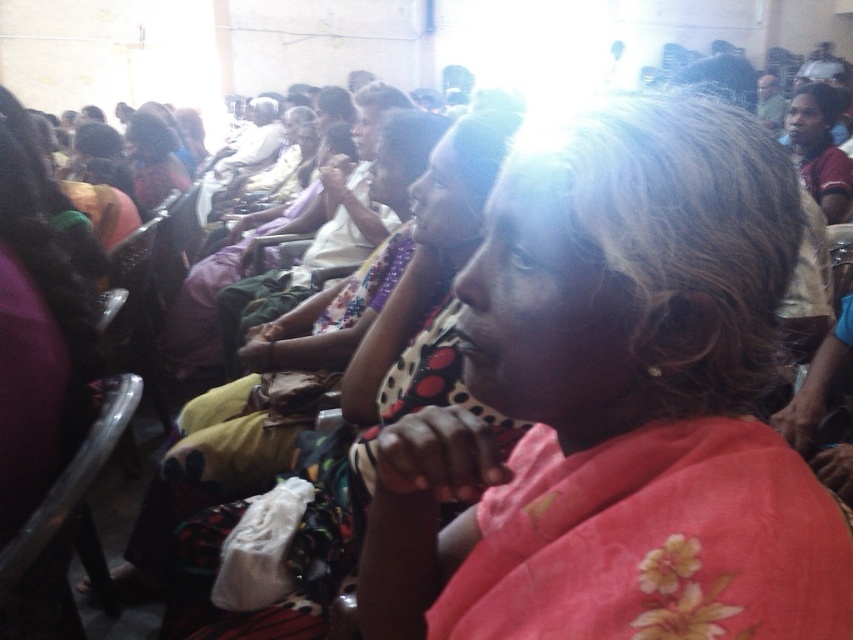
Question: Which of the following is the closest to the observer?

Choices:
 (A) (469, 522)
 (B) (396, 288)

Answer: (A)

Question: Can you confirm if floral pink scarf at center is smaller than polka dot fabric dress at center?

Choices:
 (A) no
 (B) yes

Answer: (B)

Question: Is floral pink scarf at center smaller than polka dot fabric dress at center?

Choices:
 (A) no
 (B) yes

Answer: (B)

Question: Can you confirm if floral pink scarf at center is bigger than polka dot fabric dress at center?

Choices:
 (A) no
 (B) yes

Answer: (A)